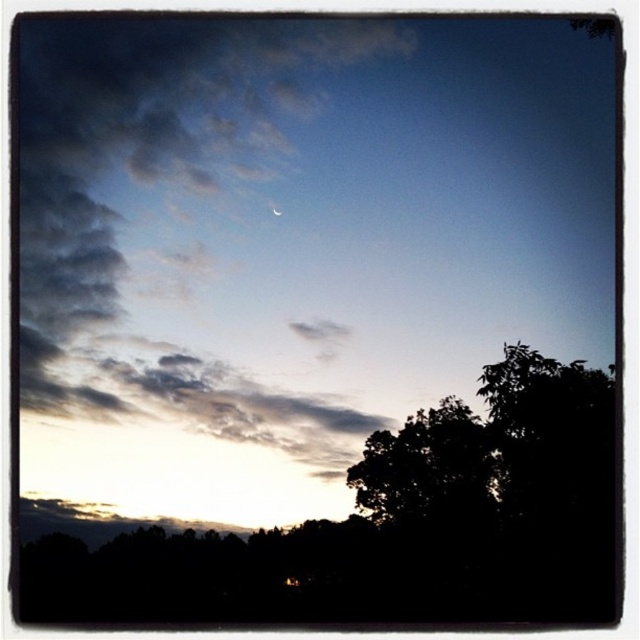
Question: From the image, what is the correct spatial relationship of cloudy sky at upper left in relation to silhouette leafy tree at lower right?

Choices:
 (A) below
 (B) above

Answer: (B)

Question: Which object is closer to the camera taking this photo?

Choices:
 (A) cloudy sky at upper left
 (B) silhouette leafy tree at lower right

Answer: (B)

Question: Is cloudy sky at upper left below satin silver crescent at upper center?

Choices:
 (A) yes
 (B) no

Answer: (A)

Question: Which point appears farthest from the camera in this image?

Choices:
 (A) (145, 400)
 (B) (282, 212)
 (C) (451, 598)

Answer: (B)

Question: Which of the following is the farthest from the observer?

Choices:
 (A) satin silver crescent at upper center
 (B) cloudy sky at upper left

Answer: (A)

Question: Does cloudy sky at upper left have a smaller size compared to satin silver crescent at upper center?

Choices:
 (A) no
 (B) yes

Answer: (A)